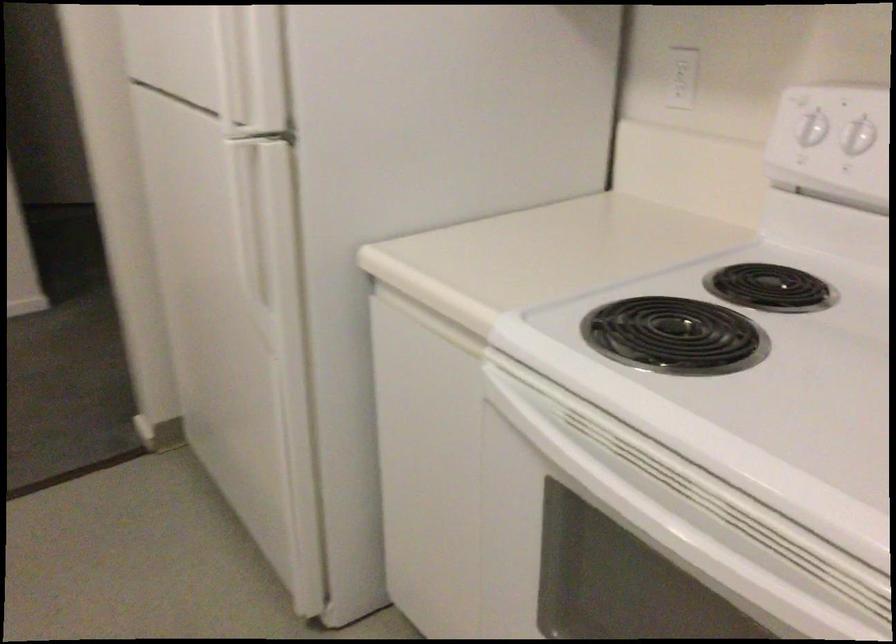
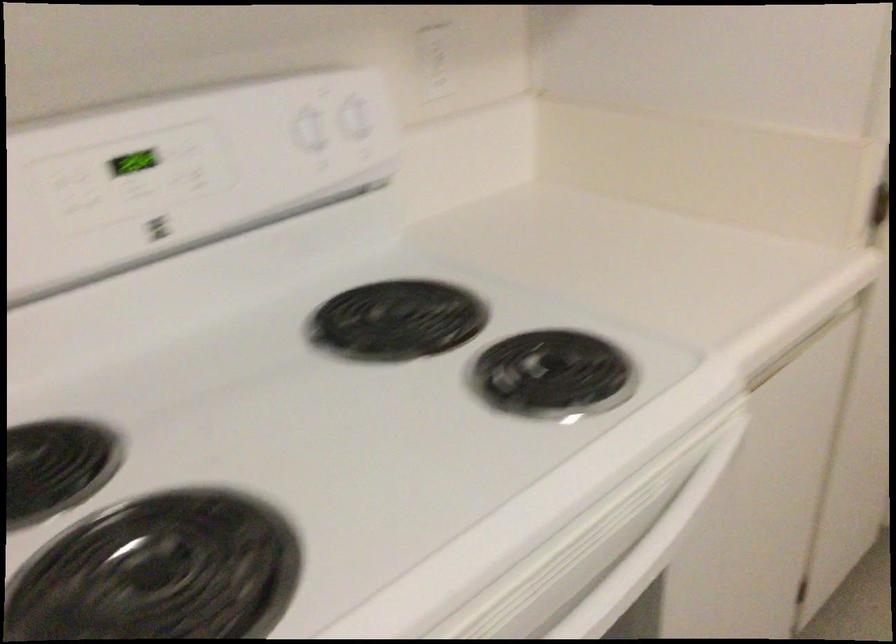
The first image is from the beginning of the video and the second image is from the end. How did the camera likely rotate when shooting the video?

The camera rotated toward right-down.